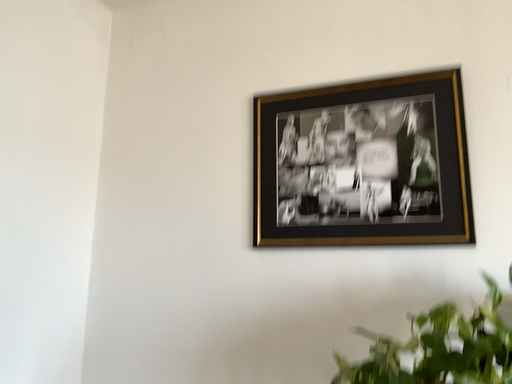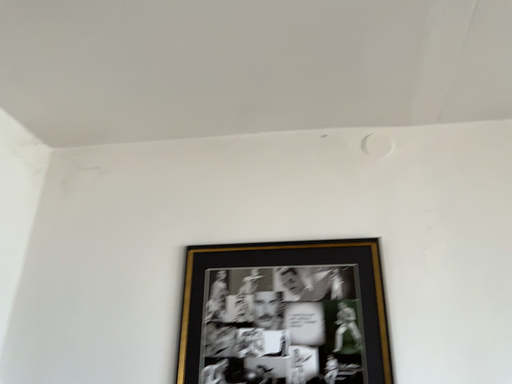
Question: How did the camera likely rotate when shooting the video?

Choices:
 (A) rotated right
 (B) rotated left

Answer: (A)